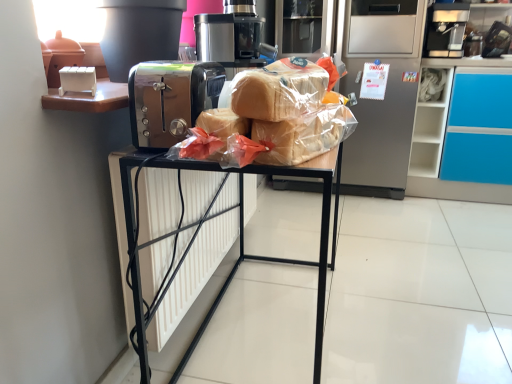
Question: From the image's perspective, does metallic black toaster at center appear higher than silver metallic refrigerator at center?

Choices:
 (A) yes
 (B) no

Answer: (B)

Question: Can you confirm if metallic black toaster at center is positioned to the right of silver metallic refrigerator at center?

Choices:
 (A) yes
 (B) no

Answer: (B)

Question: Can you confirm if metallic black toaster at center is wider than silver metallic refrigerator at center?

Choices:
 (A) yes
 (B) no

Answer: (B)

Question: Is metallic black toaster at center far away from silver metallic refrigerator at center?

Choices:
 (A) yes
 (B) no

Answer: (A)

Question: Is metallic black toaster at center in front of silver metallic refrigerator at center?

Choices:
 (A) yes
 (B) no

Answer: (A)

Question: From a real-world perspective, is black plastic coffee machine at upper right above or below satin chrome toaster at center?

Choices:
 (A) below
 (B) above

Answer: (B)

Question: Do you think black plastic coffee machine at upper right is within satin chrome toaster at center, or outside of it?

Choices:
 (A) outside
 (B) inside

Answer: (A)

Question: Is point (454, 6) positioned closer to the camera than point (176, 72)?

Choices:
 (A) farther
 (B) closer

Answer: (A)

Question: In terms of width, does black plastic coffee machine at upper right look wider or thinner when compared to satin chrome toaster at center?

Choices:
 (A) thin
 (B) wide

Answer: (B)

Question: From a real-world perspective, is metallic black toaster at center positioned above or below translucent plastic bread at center?

Choices:
 (A) below
 (B) above

Answer: (A)

Question: From the image's perspective, is metallic black toaster at center above or below translucent plastic bread at center?

Choices:
 (A) above
 (B) below

Answer: (B)

Question: Is metallic black toaster at center in front of or behind translucent plastic bread at center in the image?

Choices:
 (A) behind
 (B) front

Answer: (A)

Question: Considering the positions of metallic black toaster at center and translucent plastic bread at center in the image, is metallic black toaster at center bigger or smaller than translucent plastic bread at center?

Choices:
 (A) big
 (B) small

Answer: (A)

Question: From the image's perspective, relative to black plastic coffee machine at upper right, is translucent plastic bread at center above or below?

Choices:
 (A) above
 (B) below

Answer: (B)

Question: Looking at the image, does translucent plastic bread at center seem bigger or smaller compared to black plastic coffee machine at upper right?

Choices:
 (A) big
 (B) small

Answer: (B)